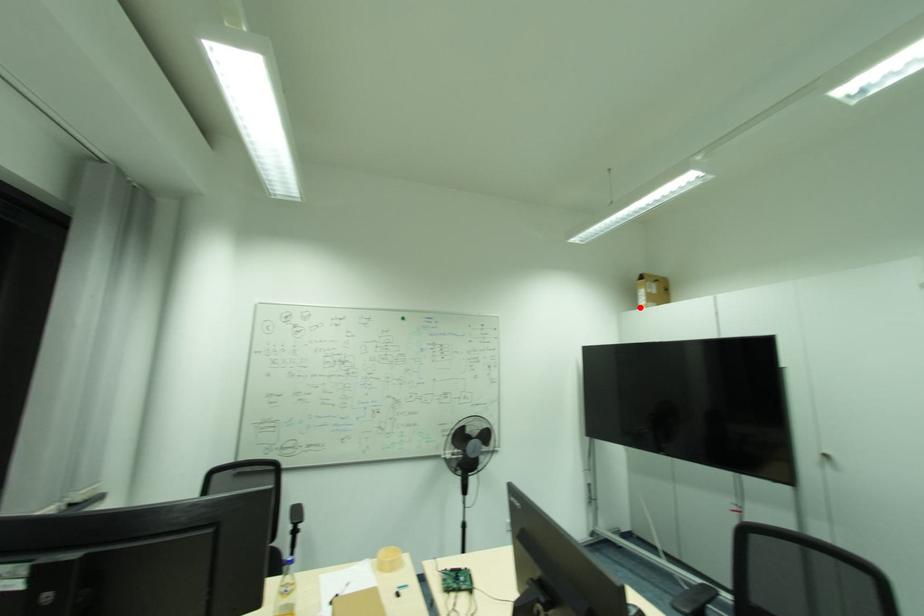
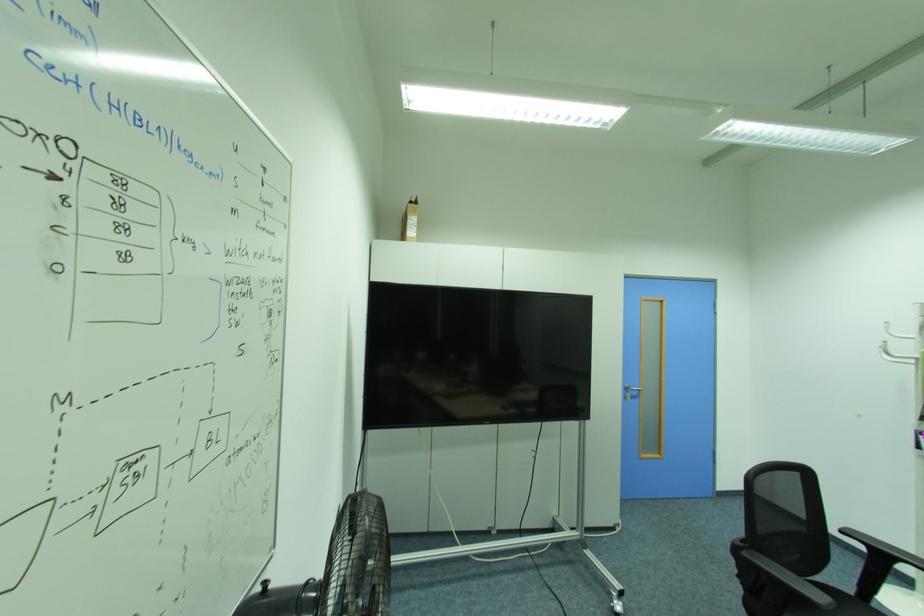
Where in the second image is the point corresponding to the highlighted location from the first image?

(407, 237)